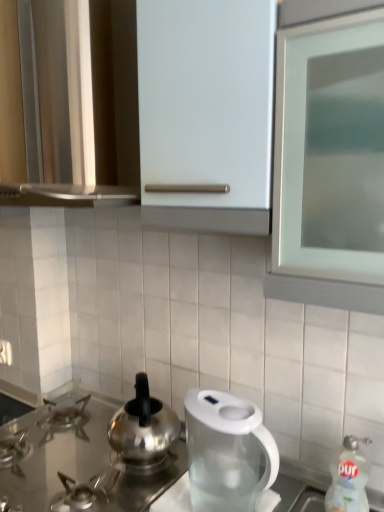
This screenshot has height=512, width=384. I want to click on blank space situated above transparent plastic kettle at center (from a real-world perspective), so coord(228,409).